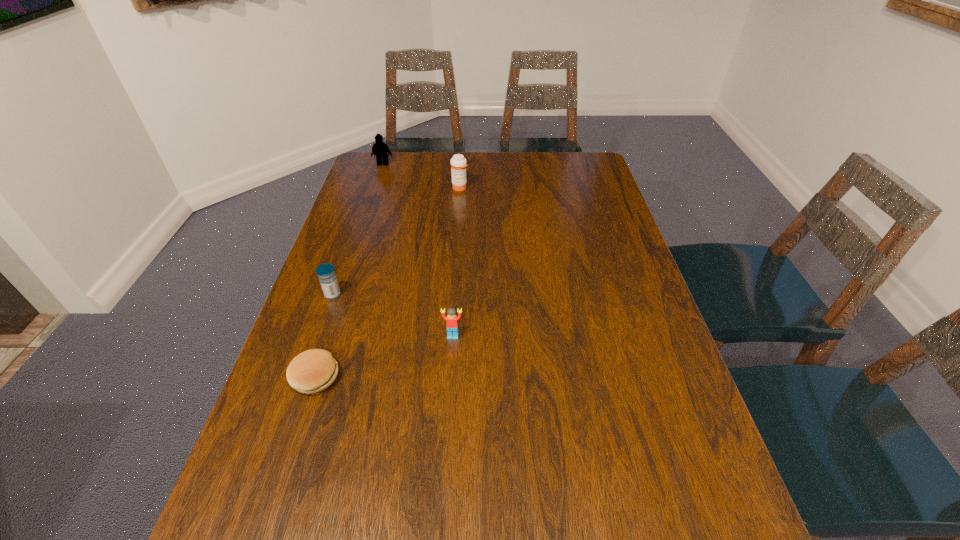
Where is `object situated at the far left corner`? The width and height of the screenshot is (960, 540). object situated at the far left corner is located at coordinates (380, 149).

Locate an element on the screen. vacant space at the left edge is located at coordinates (272, 467).

At what (x,y) coordinates should I click in order to perform the action: click on vacant region at the right edge of the desktop. Please return your answer as a coordinate pair (x, y). Looking at the image, I should click on (583, 207).

Where is `vacant region at the far left corner of the desktop`? This screenshot has width=960, height=540. vacant region at the far left corner of the desktop is located at coordinates (408, 154).

In the image, there is a desktop. Where is `vacant space at the far right corner`? The width and height of the screenshot is (960, 540). vacant space at the far right corner is located at coordinates (591, 169).

Where is `vacant point located between the left medicine and the right medicine`? vacant point located between the left medicine and the right medicine is located at coordinates (396, 241).

Identify the location of vacant point located between the nearer Lego and the farther medicine. (456, 262).

Find the location of `unoccupied position between the patty and the right medicine`. unoccupied position between the patty and the right medicine is located at coordinates (388, 282).

Where is `vacant space in between the taller Lego and the patty`? This screenshot has width=960, height=540. vacant space in between the taller Lego and the patty is located at coordinates (349, 271).

This screenshot has height=540, width=960. Identify the location of vacant area that lies between the shortest object and the third farthest object. (324, 336).